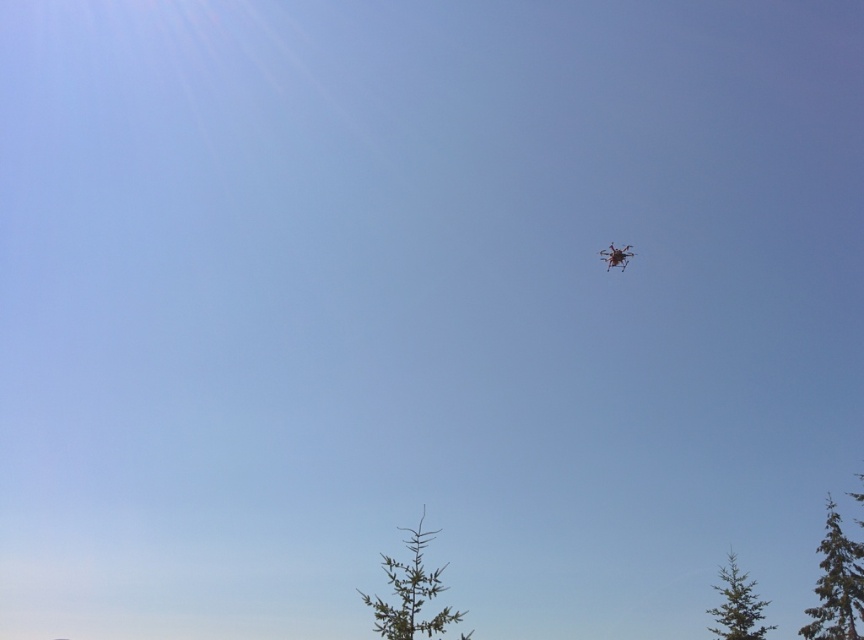
Does green textured tree at lower right have a lesser width compared to green matte tree at lower right?

Incorrect, green textured tree at lower right's width is not less than green matte tree at lower right's.

Measure the distance from green textured tree at lower right to green matte tree at lower right.

6.31 meters

The height and width of the screenshot is (640, 864). What do you see at coordinates (836, 582) in the screenshot? I see `green textured tree at lower right` at bounding box center [836, 582].

Image resolution: width=864 pixels, height=640 pixels. I want to click on green textured tree at lower right, so click(836, 582).

Between green textured tree at lower right and metallic silver drone at upper right, which one is positioned lower?

green textured tree at lower right is lower down.

Is point (827, 563) closer to camera compared to point (611, 252)?

No.

Identify the location of green textured tree at lower right. The width and height of the screenshot is (864, 640). (836, 582).

Does green matte tree at lower center appear over green matte tree at lower right?

Yes, green matte tree at lower center is above green matte tree at lower right.

Is point (415, 566) behind point (723, 589)?

No, (415, 566) is in front of (723, 589).

In order to click on green matte tree at lower center in this screenshot , I will do `click(410, 593)`.